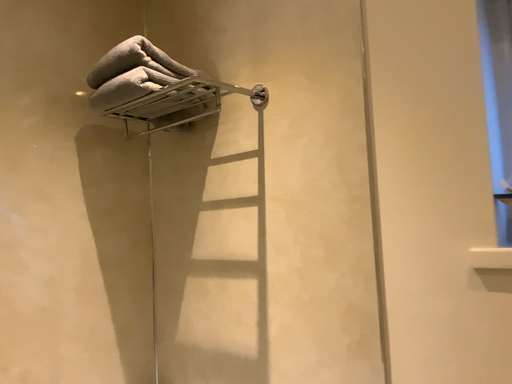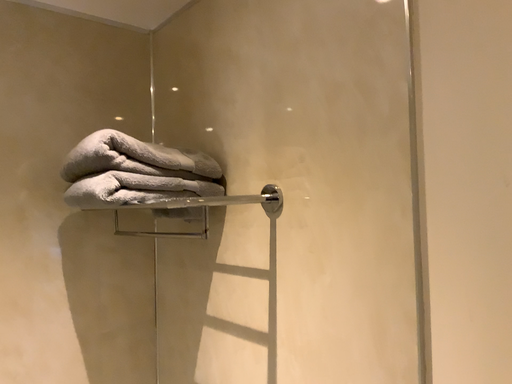
Question: Which way did the camera rotate in the video?

Choices:
 (A) rotated right
 (B) rotated left

Answer: (B)